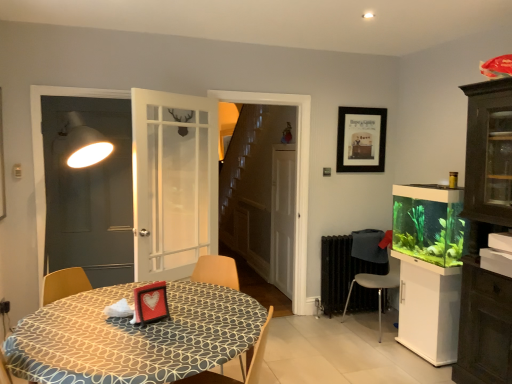
Question: Choose the correct answer: Is metallic gray chair at lower right, acting as the 1th chair starting from the right, inside patterned fabric table at lower left or outside it?

Choices:
 (A) inside
 (B) outside

Answer: (B)

Question: From the image's perspective, relative to patterned fabric table at lower left, is metallic gray chair at lower right, arranged as the second chair when viewed from the left, above or below?

Choices:
 (A) above
 (B) below

Answer: (A)

Question: Estimate the real-world distances between objects in this image. Which object is closer to the matte white screen door at left, the 1th screen door in the left-to-right sequence?

Choices:
 (A) patterned fabric table at lower left
 (B) white glossy cabinet at right
 (C) wooden chair at table, the 2th chair viewed from the right
 (D) black matte picture frame at upper center
 (E) metallic gray chair at lower right, positioned as the second chair in front-to-back order

Answer: (A)

Question: Which is farther from the wooden chair at table, the second chair positioned from the back?

Choices:
 (A) matte white screen door at left, positioned as the second screen door in right-to-left order
 (B) patterned fabric table at lower left
 (C) white matte screen door at center, the second screen door from the front
 (D) metallic gray chair at lower right, positioned as the second chair in front-to-back order
 (E) green matte aquarium at right

Answer: (C)